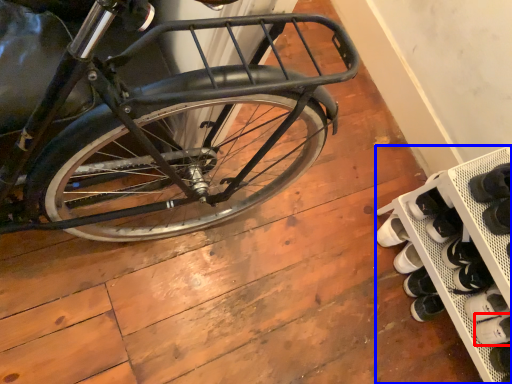
Question: Which point is further to the camera, shoe (highlighted by a red box) or shelf (highlighted by a blue box)?

Choices:
 (A) shoe
 (B) shelf

Answer: (A)